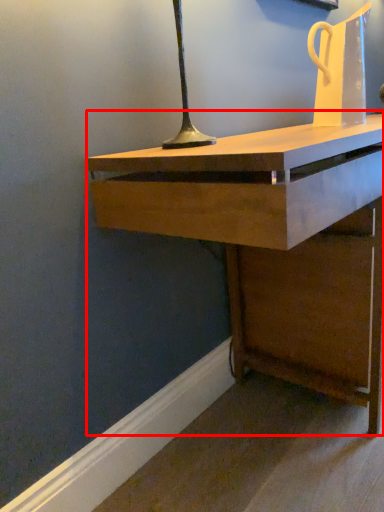
Question: From the image, what is the correct spatial relationship of desk (annotated by the red box) in relation to jug?

Choices:
 (A) left
 (B) right

Answer: (B)